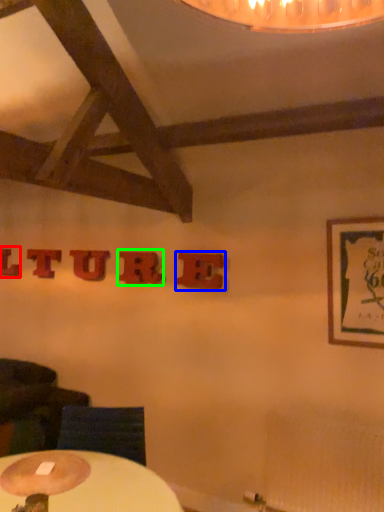
Question: Which object is positioned farthest from letter (highlighted by a red box)? Select from letter (highlighted by a blue box) and letter (highlighted by a green box).

Choices:
 (A) letter
 (B) letter

Answer: (A)